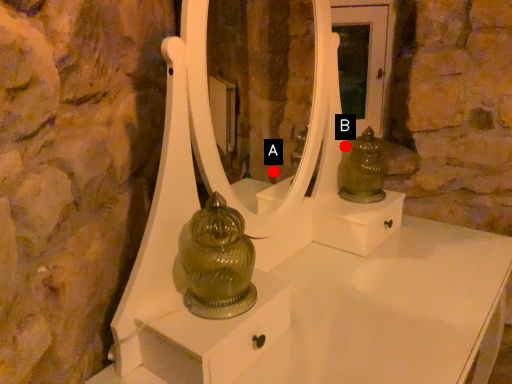
Question: Two points are circled on the image, labeled by A and B beside each circle. Which point is farther to the camera?

Choices:
 (A) A is further
 (B) B is further

Answer: (A)